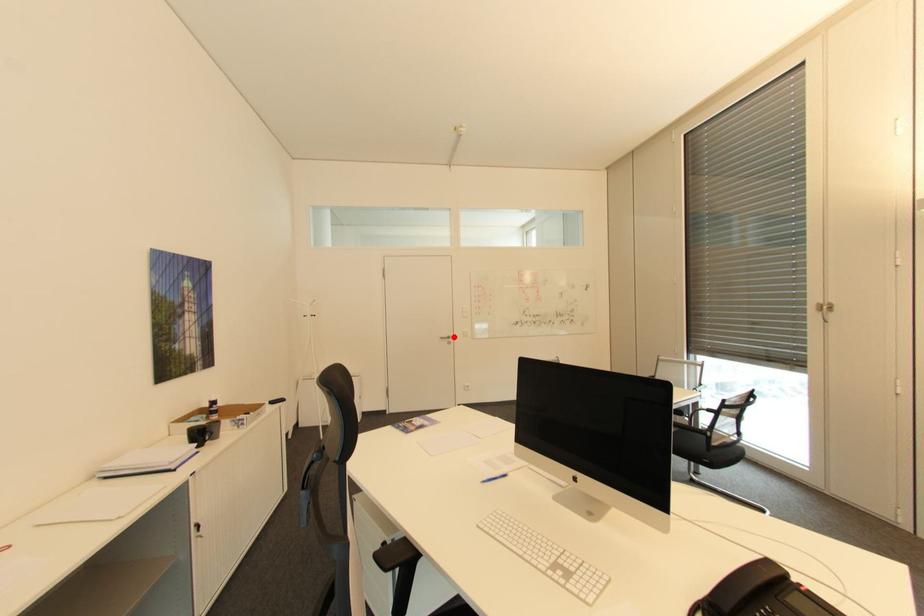
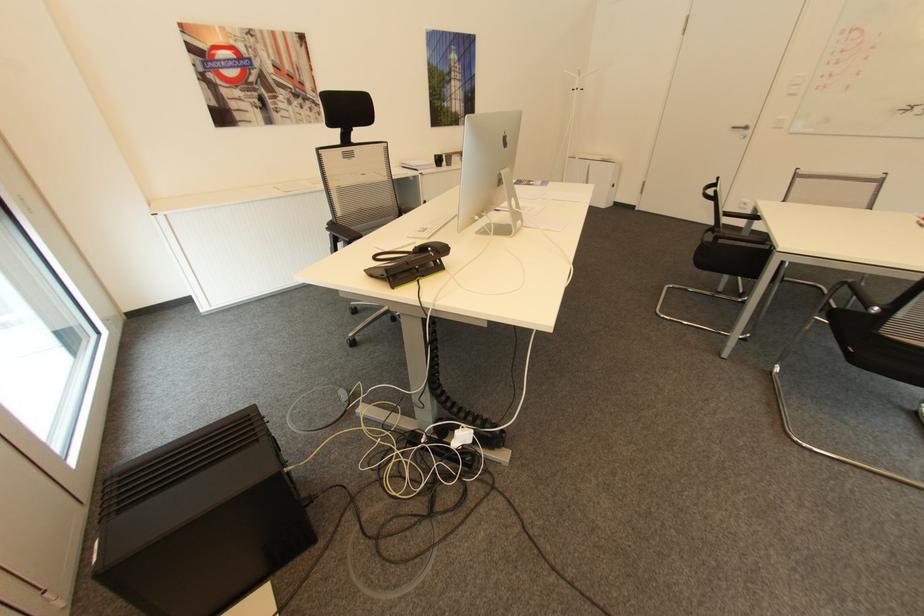
Find the pixel in the second image that matches the highlighted location in the first image.

(749, 128)